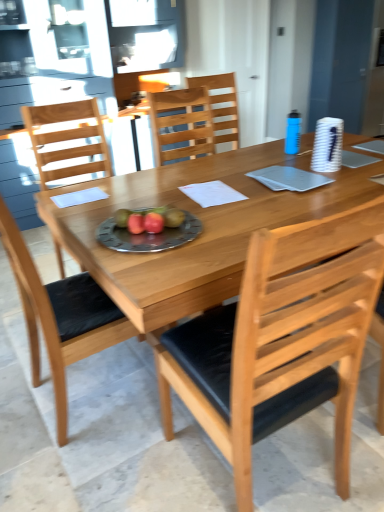
I want to click on space that is in front of red matte apple at center, placed as the second fruit when sorted from right to left, so click(x=137, y=251).